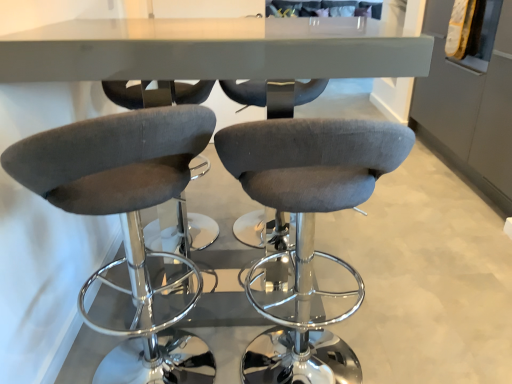
Question: Is dark gray fabric stool at left, which appears as the 2th chair when viewed from the right, taller than velvet grey stool at center, which ranks as the first chair in right-to-left order?

Choices:
 (A) yes
 (B) no

Answer: (A)

Question: Is dark gray fabric stool at left, which appears as the 2th chair when viewed from the right, bigger than velvet grey stool at center, the second chair viewed from the left?

Choices:
 (A) no
 (B) yes

Answer: (B)

Question: Is dark gray fabric stool at left, which appears as the 2th chair when viewed from the right, wider than velvet grey stool at center, the second chair viewed from the left?

Choices:
 (A) no
 (B) yes

Answer: (B)

Question: Is there a large distance between dark gray fabric stool at left, the first chair from the left, and velvet grey stool at center, the second chair viewed from the left?

Choices:
 (A) yes
 (B) no

Answer: (B)

Question: Is dark gray fabric stool at left, which appears as the 2th chair when viewed from the right, closer to camera compared to velvet grey stool at center, which ranks as the first chair in right-to-left order?

Choices:
 (A) no
 (B) yes

Answer: (B)

Question: Is dark gray fabric stool at left, which appears as the 2th chair when viewed from the right, placed right next to velvet grey stool at center, the second chair viewed from the left?

Choices:
 (A) no
 (B) yes

Answer: (A)

Question: Is velvet grey stool at center, the second chair viewed from the left, positioned with its back to dark gray fabric stool at left, the first chair from the left?

Choices:
 (A) yes
 (B) no

Answer: (B)

Question: Is velvet grey stool at center, the second chair viewed from the left, further to the viewer compared to dark gray fabric stool at left, the first chair from the left?

Choices:
 (A) no
 (B) yes

Answer: (B)

Question: From a real-world perspective, is velvet grey stool at center, which ranks as the first chair in right-to-left order, physically above dark gray fabric stool at left, the first chair from the left?

Choices:
 (A) yes
 (B) no

Answer: (B)

Question: From the image's perspective, is velvet grey stool at center, the second chair viewed from the left, under dark gray fabric stool at left, the first chair from the left?

Choices:
 (A) yes
 (B) no

Answer: (B)

Question: Is velvet grey stool at center, which ranks as the first chair in right-to-left order, smaller than dark gray fabric stool at left, which appears as the 2th chair when viewed from the right?

Choices:
 (A) no
 (B) yes

Answer: (B)

Question: Does velvet grey stool at center, the second chair viewed from the left, have a lesser width compared to dark gray fabric stool at left, which appears as the 2th chair when viewed from the right?

Choices:
 (A) no
 (B) yes

Answer: (B)

Question: Visually, is velvet grey stool at center, the second chair viewed from the left, positioned to the left or to the right of dark gray fabric stool at left, which appears as the 2th chair when viewed from the right?

Choices:
 (A) left
 (B) right

Answer: (B)